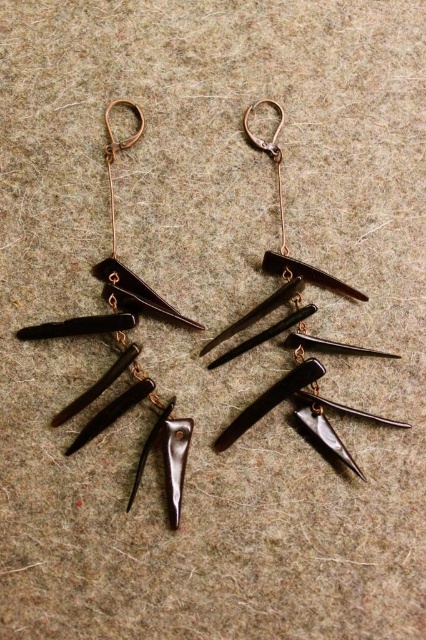
Does matte black spike at upper left appear on the left side of matte black spike at upper center?

Correct, you'll find matte black spike at upper left to the left of matte black spike at upper center.

Does matte black spike at upper left have a lesser width compared to matte black spike at upper center?

Correct, matte black spike at upper left's width is less than matte black spike at upper center's.

Who is more distant from viewer, (x=141, y=132) or (x=288, y=262)?

Point (x=288, y=262)

At what (x,y) coordinates should I click in order to perform the action: click on matte black spike at upper left. Please return your answer as a coordinate pair (x, y). The height and width of the screenshot is (640, 426). Looking at the image, I should click on pos(115,243).